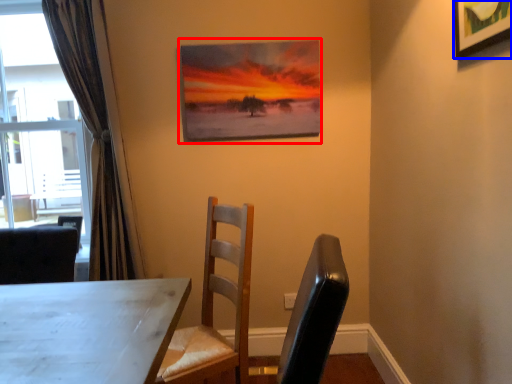
Question: Among these objects, which one is farthest to the camera, picture frame (highlighted by a red box) or picture frame (highlighted by a blue box)?

Choices:
 (A) picture frame
 (B) picture frame

Answer: (A)